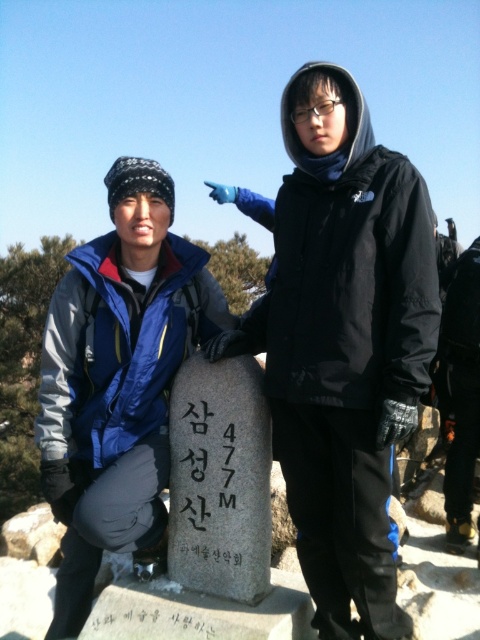
Question: Can you confirm if gray stone at center is smaller than black stone sign at center?

Choices:
 (A) yes
 (B) no

Answer: (B)

Question: Which is farther from the gray stone at center?

Choices:
 (A) black stone marker at center
 (B) blue fleece jacket at lower left
 (C) black stone sign at center

Answer: (A)

Question: Can you confirm if gray stone at center is bigger than black stone sign at center?

Choices:
 (A) yes
 (B) no

Answer: (A)

Question: Which object is closer to the camera taking this photo?

Choices:
 (A) black stone marker at center
 (B) gray stone at center

Answer: (A)

Question: Does gray stone at center appear over black stone marker at center?

Choices:
 (A) no
 (B) yes

Answer: (B)

Question: Among these points, which one is farthest from the camera?

Choices:
 (A) (176, 435)
 (B) (163, 296)
 (C) (228, 593)

Answer: (B)